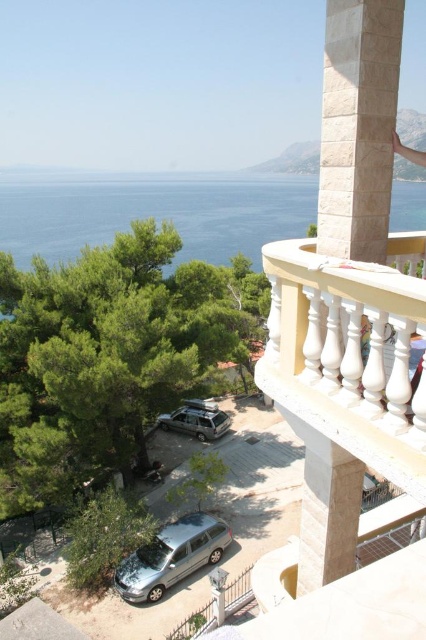
Can you confirm if metallic silver railing at lower center is smaller than satin silver suv at lower center?

Actually, metallic silver railing at lower center might be larger than satin silver suv at lower center.

Which is behind, point (236, 580) or point (181, 428)?

The point (181, 428) is more distant.

Locate an element on the screen. The height and width of the screenshot is (640, 426). metallic silver railing at lower center is located at coordinates (216, 608).

Is beige stone column at upper right positioned in front of satin silver suv at lower center?

That is True.

Is beige stone column at upper right wider than satin silver suv at lower center?

Yes.

What do you see at coordinates (357, 125) in the screenshot? I see `beige stone column at upper right` at bounding box center [357, 125].

Locate an element on the screen. The width and height of the screenshot is (426, 640). beige stone column at upper right is located at coordinates (357, 125).

Is the position of blue water at upper center less distant than that of metallic silver railing at lower center?

No, blue water at upper center is behind metallic silver railing at lower center.

Does blue water at upper center appear on the right side of metallic silver railing at lower center?

Indeed, blue water at upper center is positioned on the right side of metallic silver railing at lower center.

Does point (22, 200) lie behind point (195, 634)?

Yes, point (22, 200) is farther from viewer.

Locate an element on the screen. The height and width of the screenshot is (640, 426). blue water at upper center is located at coordinates (152, 212).